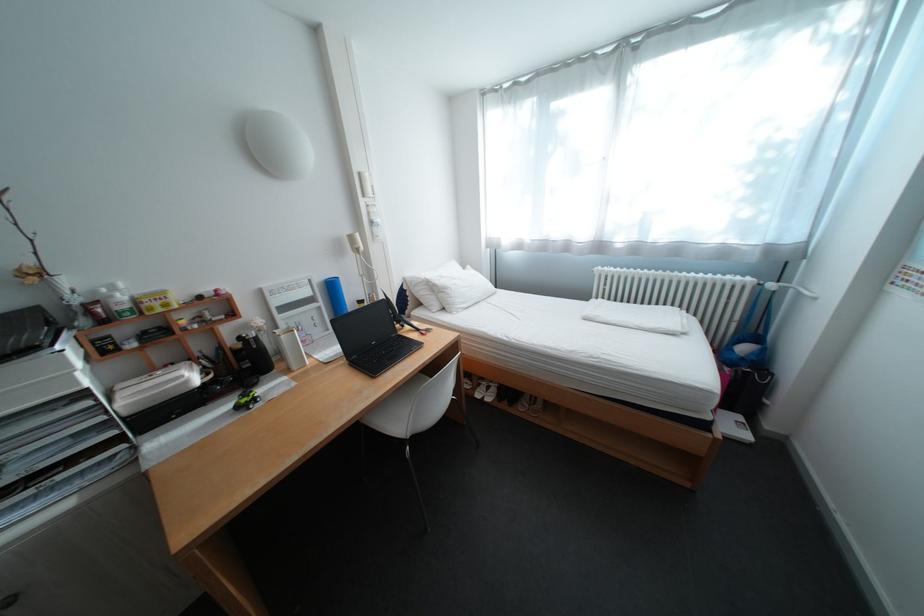
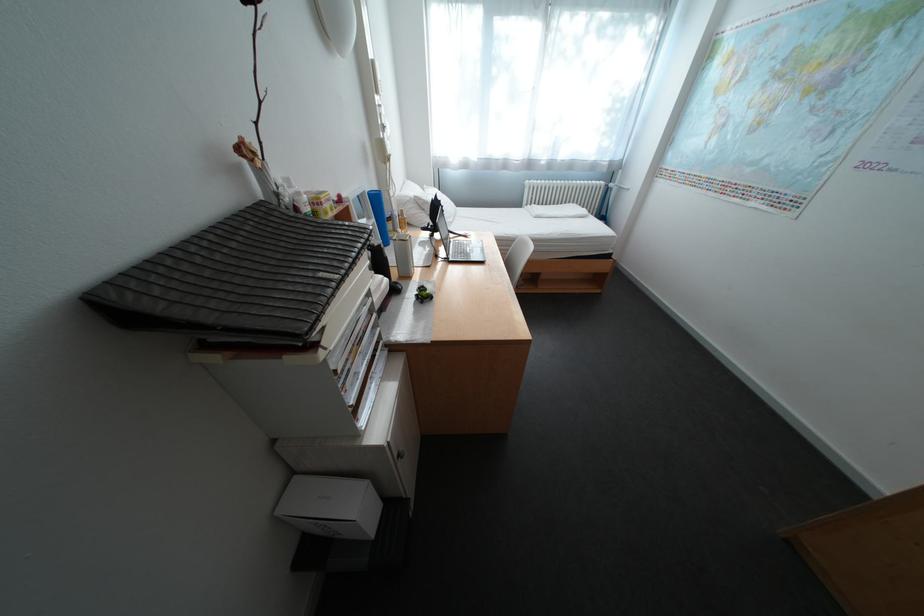
Locate, in the second image, the point that corresponds to pixel 431 331 in the first image.

(472, 236)